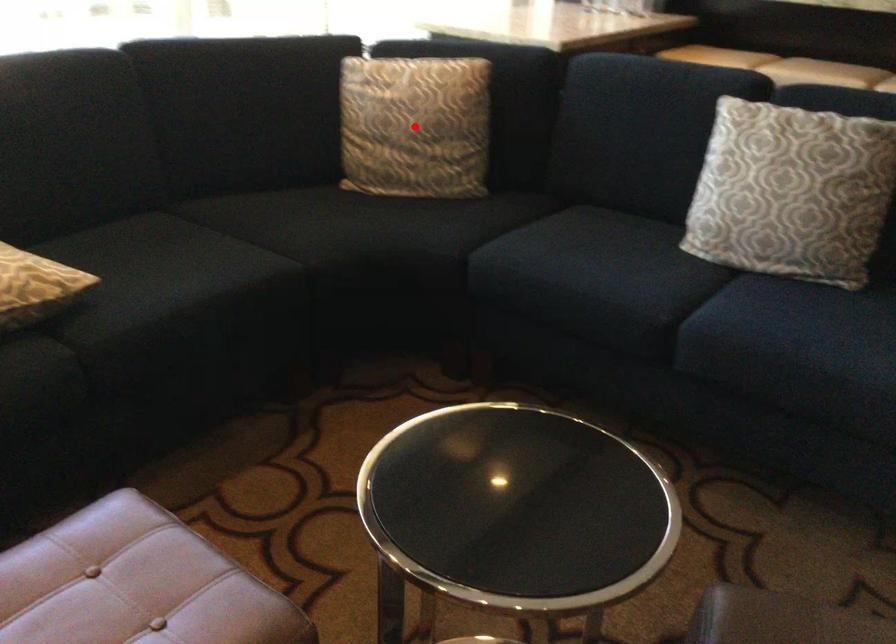
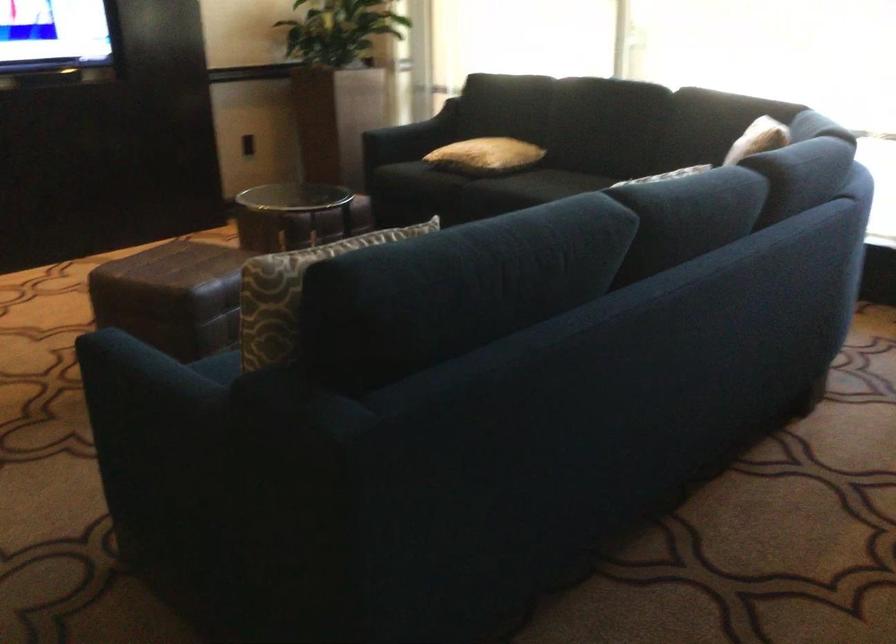
Question: I am providing you with two images of the same scene from different viewpoints. A red point is marked on the first image. Is the red point's position out of view in image 2?

Choices:
 (A) Yes
 (B) No

Answer: (A)